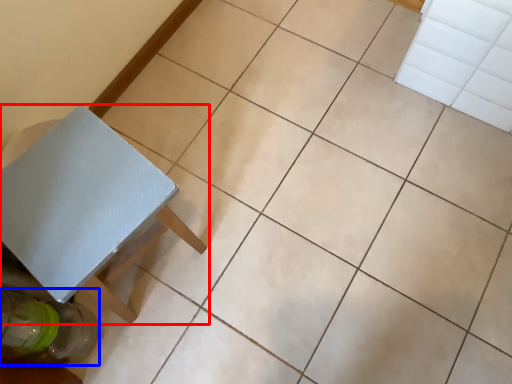
Question: Which of the following is the farthest to the observer, table (highlighted by a red box) or glass bottle (highlighted by a blue box)?

Choices:
 (A) table
 (B) glass bottle

Answer: (B)